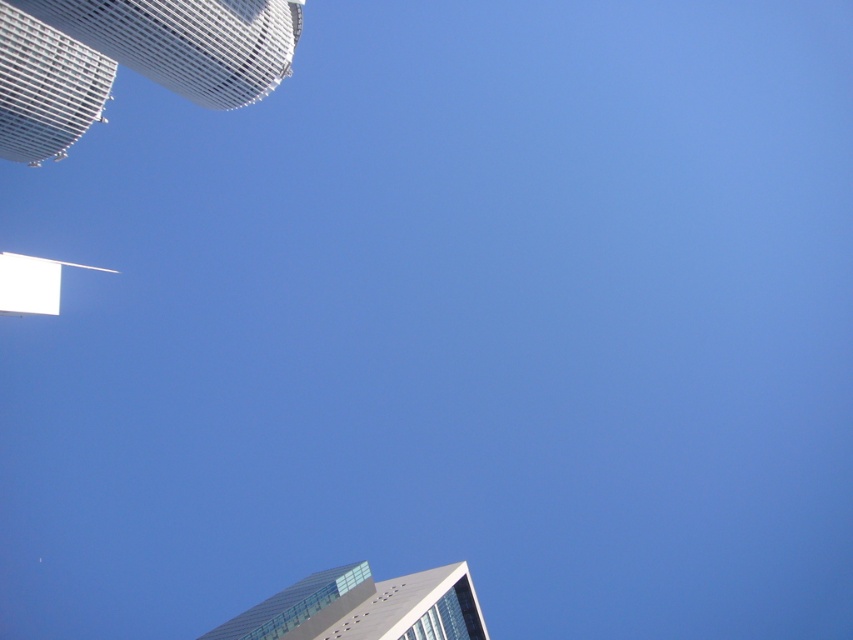
Question: Is white mesh tower at upper left to the left of glassy steel skyscraper at lower center from the viewer's perspective?

Choices:
 (A) no
 (B) yes

Answer: (B)

Question: Can you confirm if white mesh tower at upper left is wider than glassy steel skyscraper at lower center?

Choices:
 (A) yes
 (B) no

Answer: (A)

Question: Which of the following is the farthest from the observer?

Choices:
 (A) (125, 36)
 (B) (421, 588)

Answer: (A)

Question: Does white mesh tower at upper left have a greater width compared to glassy steel skyscraper at lower center?

Choices:
 (A) no
 (B) yes

Answer: (B)